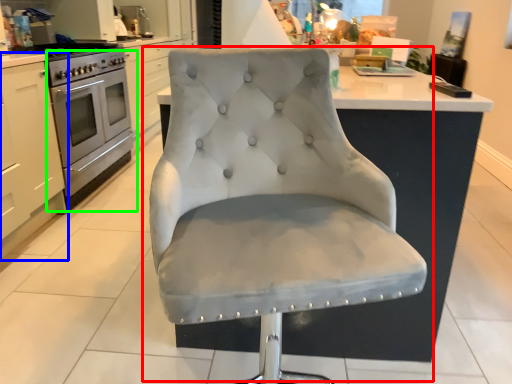
Question: Which object is the farthest from chair (highlighted by a red box)? Choose among these: cabinetry (highlighted by a blue box) or oven (highlighted by a green box).

Choices:
 (A) cabinetry
 (B) oven

Answer: (B)